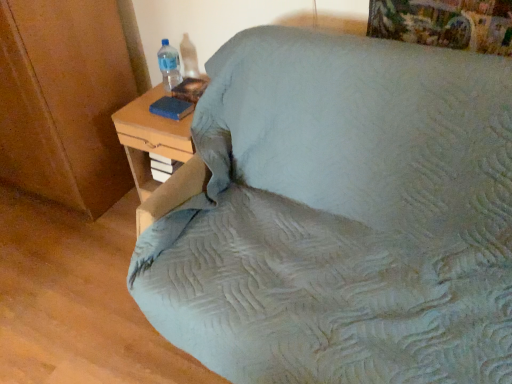
You are a GUI agent. You are given a task and a screenshot of the screen. Output one action in this format:
    pyautogui.click(x=<x>, y=<y>)
    Task: Click on the free space to the left of blue matte book at upper left
    The image size is (512, 384).
    Given the screenshot: What is the action you would take?
    point(140,112)